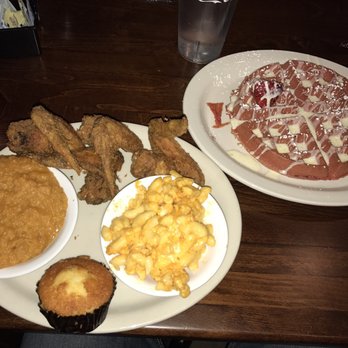
This screenshot has width=348, height=348. I want to click on wood table, so click(124, 75).